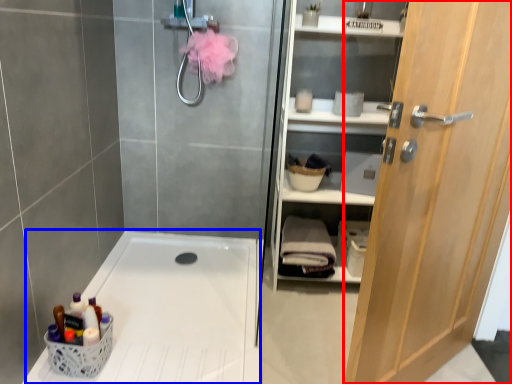
Question: Among these objects, which one is farthest to the camera, door (highlighted by a red box) or bath (highlighted by a blue box)?

Choices:
 (A) door
 (B) bath

Answer: (B)